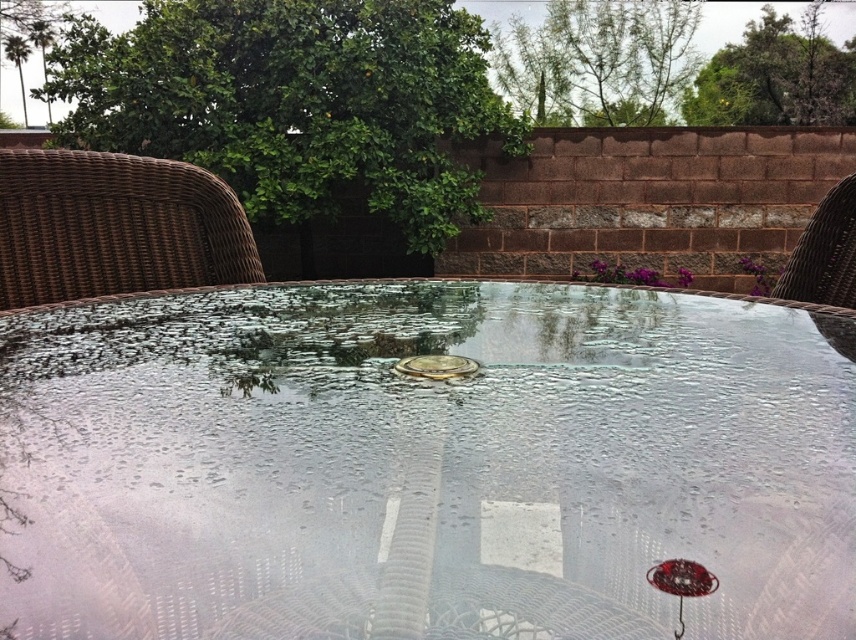
You are a delivery person trying to place a large pizza box on the transparent glass table at center. However, you notice the brown wicker chair at left is nearby. Is there enough space between them to safely place the pizza box without it hanging off the edge?

The transparent glass table at center and brown wicker chair at left are 25.11 inches apart from each other. Since the pizza box is large, but the distance between the table and chair is sufficient, you can safely place the pizza box on the transparent glass table at center without it hanging off the edge.

You are standing on the patio and want to pick up both items located at point [116,323] and point [462,371]. Which item should you pick up first to minimize walking distance?

You should pick up the item at point [116,323] first because it is closer to you than the item at point [462,371].

You are sitting on the brown wicker chair at left and want to place a small book on the transparent glass table at center. Can you reach the table without moving from your current position?

The transparent glass table at center is closer to the viewer than the brown wicker chair at left, so you are sitting further back from the table. Therefore, you might not be able to reach the table from your current position without moving closer.